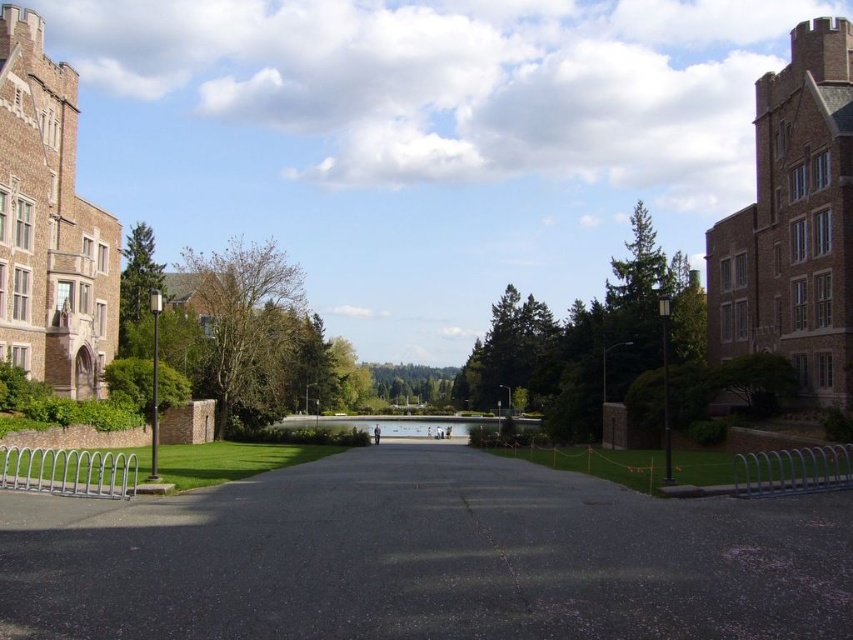
Question: Considering the relative positions of black asphalt path at center and clear glass lake at center in the image provided, where is black asphalt path at center located with respect to clear glass lake at center?

Choices:
 (A) right
 (B) left

Answer: (A)

Question: Can you confirm if black asphalt path at center is wider than clear glass lake at center?

Choices:
 (A) no
 (B) yes

Answer: (A)

Question: Which point appears farthest from the camera in this image?

Choices:
 (A) (519, 417)
 (B) (434, 609)

Answer: (A)

Question: Does black asphalt path at center have a smaller size compared to clear glass lake at center?

Choices:
 (A) yes
 (B) no

Answer: (A)

Question: Among these points, which one is nearest to the camera?

Choices:
 (A) (351, 422)
 (B) (412, 458)

Answer: (B)